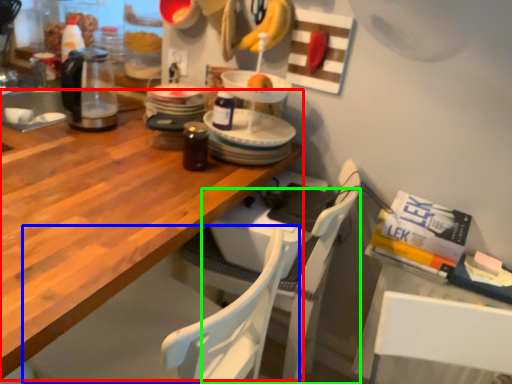
Question: Which object is positioned closest to desk (highlighted by a red box)? Select from chair (highlighted by a blue box) and chair (highlighted by a green box).

Choices:
 (A) chair
 (B) chair

Answer: (A)